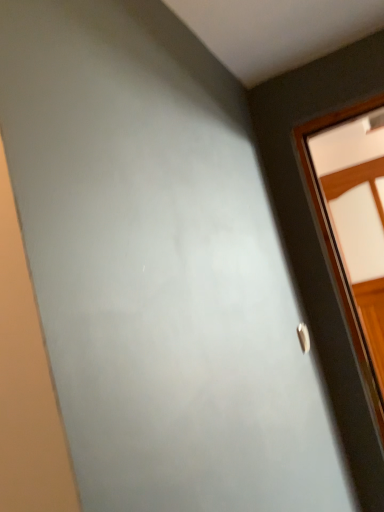
Question: Considering the relative sizes of silver metallic door handle at right and wooden window at right in the image provided, is silver metallic door handle at right bigger than wooden window at right?

Choices:
 (A) no
 (B) yes

Answer: (A)

Question: From a real-world perspective, does silver metallic door handle at right sit lower than wooden window at right?

Choices:
 (A) no
 (B) yes

Answer: (B)

Question: Is silver metallic door handle at right next to wooden window at right and touching it?

Choices:
 (A) yes
 (B) no

Answer: (B)

Question: Does silver metallic door handle at right have a lesser width compared to wooden window at right?

Choices:
 (A) no
 (B) yes

Answer: (B)

Question: Can you confirm if silver metallic door handle at right is taller than wooden window at right?

Choices:
 (A) no
 (B) yes

Answer: (A)

Question: From a real-world perspective, is silver metallic door handle at right on top of wooden window at right?

Choices:
 (A) yes
 (B) no

Answer: (B)

Question: Considering the relative sizes of wooden window at right and silver metallic door handle at right in the image provided, is wooden window at right bigger than silver metallic door handle at right?

Choices:
 (A) yes
 (B) no

Answer: (A)

Question: From the image's perspective, is wooden window at right above silver metallic door handle at right?

Choices:
 (A) yes
 (B) no

Answer: (A)

Question: Does wooden window at right lie in front of silver metallic door handle at right?

Choices:
 (A) yes
 (B) no

Answer: (B)

Question: Considering the relative sizes of wooden window at right and silver metallic door handle at right in the image provided, is wooden window at right smaller than silver metallic door handle at right?

Choices:
 (A) no
 (B) yes

Answer: (A)

Question: Is wooden window at right completely or partially outside of silver metallic door handle at right?

Choices:
 (A) yes
 (B) no

Answer: (A)

Question: Does wooden window at right have a lesser width compared to silver metallic door handle at right?

Choices:
 (A) yes
 (B) no

Answer: (B)

Question: From a real-world perspective, is wooden window at right positioned above or below silver metallic door handle at right?

Choices:
 (A) below
 (B) above

Answer: (B)